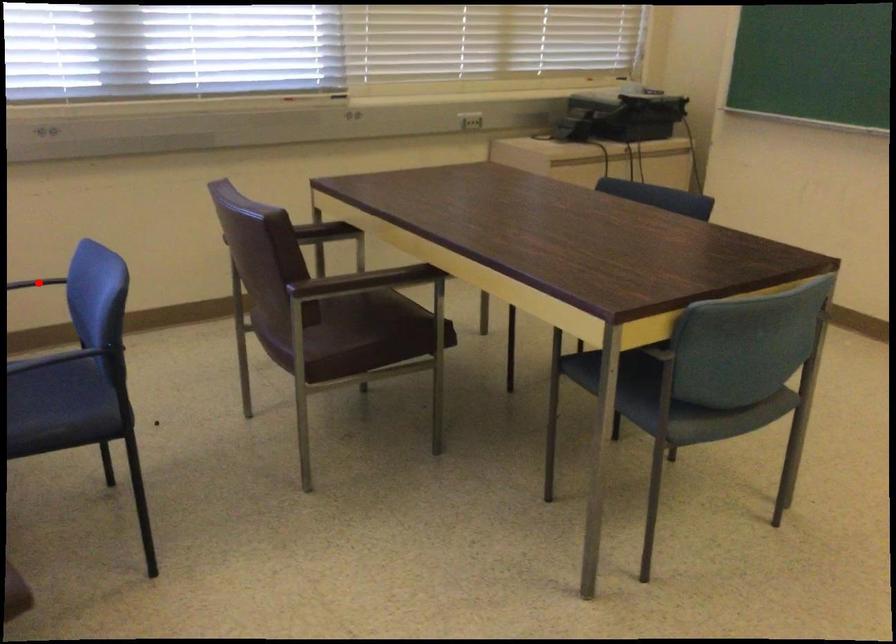
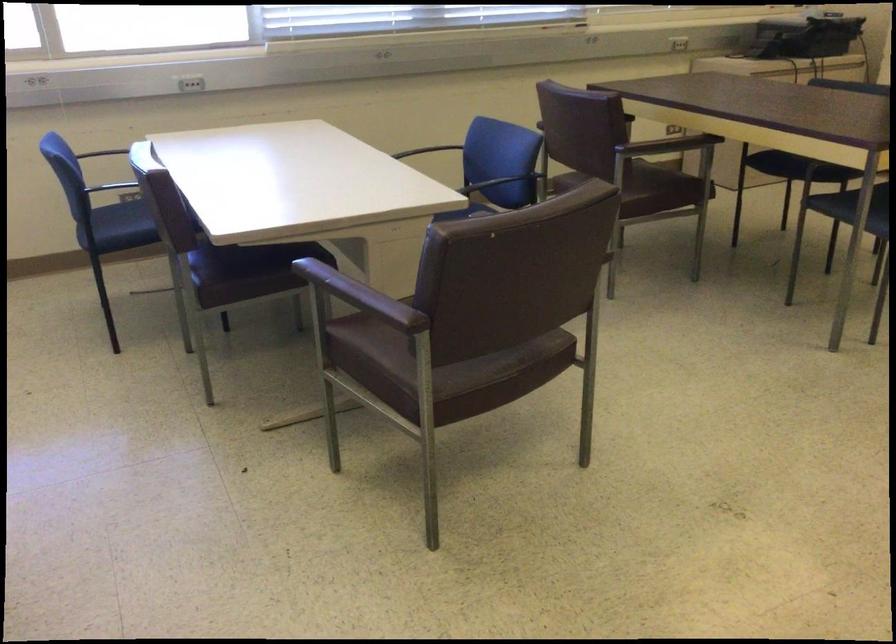
Question: I am providing you with two images of the same scene from different viewpoints. A red point is marked on the first image. At the location where the point appears in image 1, is it still visible in image 2?

Choices:
 (A) Yes
 (B) No

Answer: (B)